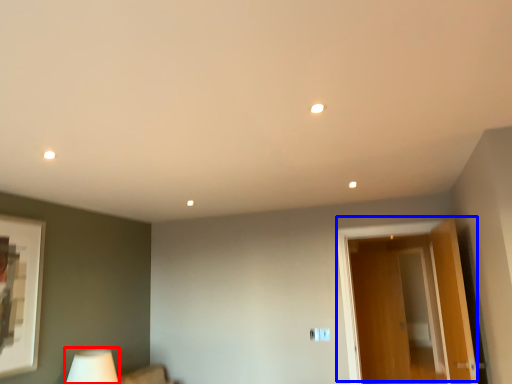
Question: Which object is closer to the camera taking this photo, table lamp (highlighted by a red box) or door (highlighted by a blue box)?

Choices:
 (A) table lamp
 (B) door

Answer: (A)